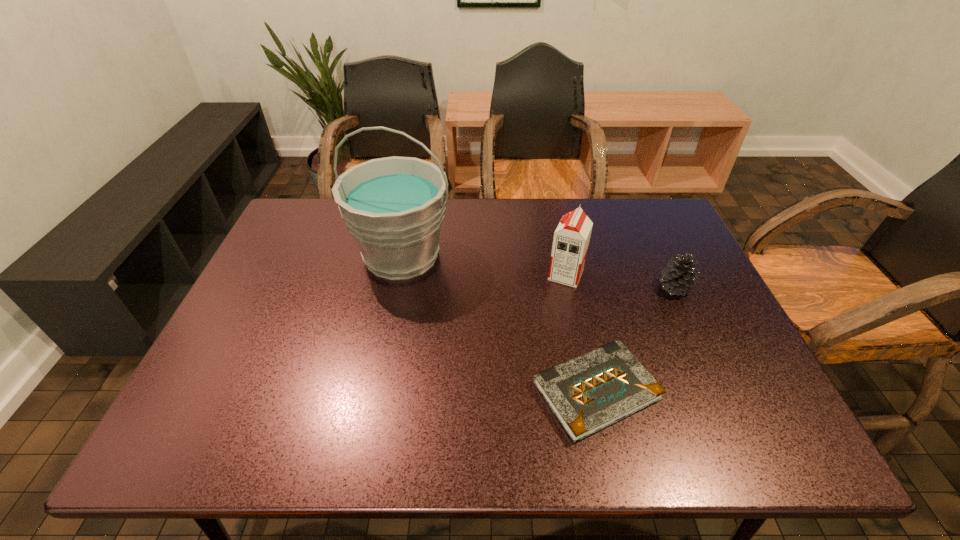
This screenshot has width=960, height=540. What are the coordinates of `vacant space located 0.210m on the right of the notebook` in the screenshot? It's located at (756, 391).

The width and height of the screenshot is (960, 540). What are the coordinates of `object present at the far edge` in the screenshot? It's located at (394, 206).

The image size is (960, 540). In order to click on object present at the near edge in this screenshot , I will do `click(587, 394)`.

You are a GUI agent. You are given a task and a screenshot of the screen. Output one action in this format:
    pyautogui.click(x=<x>, y=<y>)
    Task: Click on the object located in the right edge section of the desktop
    
    Given the screenshot: What is the action you would take?
    pyautogui.click(x=678, y=278)

The height and width of the screenshot is (540, 960). I want to click on free region at the far edge of the desktop, so click(620, 226).

The height and width of the screenshot is (540, 960). Identify the location of vacant space at the near edge of the desktop. (659, 423).

This screenshot has height=540, width=960. Find the location of `vacant position at the left edge of the desktop`. vacant position at the left edge of the desktop is located at coordinates (257, 353).

Locate an element on the screen. The width and height of the screenshot is (960, 540). blank space at the right edge is located at coordinates (709, 310).

This screenshot has width=960, height=540. In order to click on free space at the far left corner of the desktop in this screenshot , I will do `click(324, 223)`.

In the image, there is a desktop. Where is `vacant space at the far right corner`? This screenshot has height=540, width=960. vacant space at the far right corner is located at coordinates (618, 204).